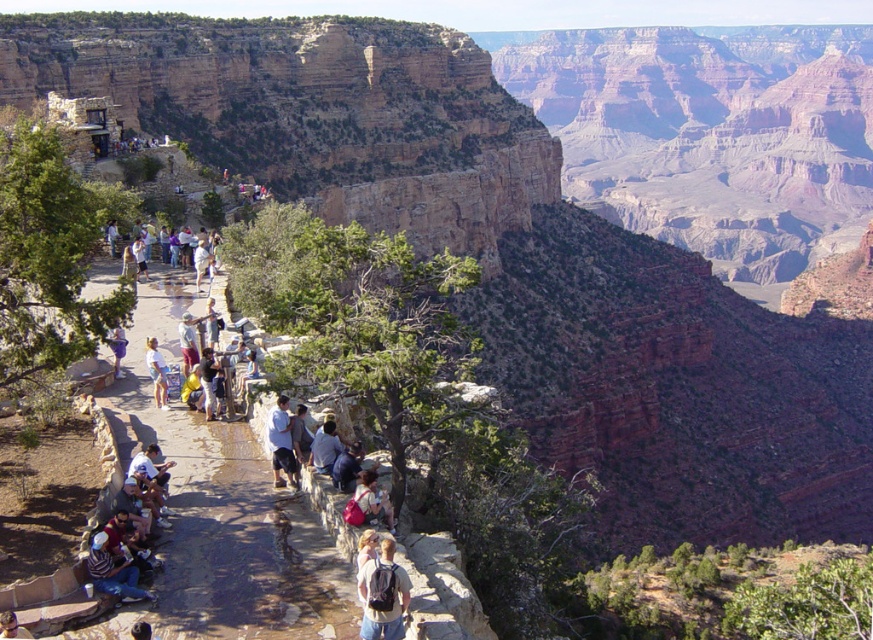
Question: Which of the following is the closest to the observer?

Choices:
 (A) light blue denim shorts at lower left
 (B) matte gray backpack at center
 (C) light blue shirt at center

Answer: (B)

Question: Is matte gray backpack at center closer to the viewer compared to light blue shirt at center?

Choices:
 (A) no
 (B) yes

Answer: (B)

Question: Which object is positioned farthest from the light brown leather jacket at lower left?

Choices:
 (A) light blue shirt at center
 (B) light blue denim shorts at lower left
 (C) matte gray backpack at center

Answer: (B)

Question: Is light blue denim shorts at center to the left of light blue denim shorts at lower left from the viewer's perspective?

Choices:
 (A) yes
 (B) no

Answer: (B)

Question: Can you confirm if light blue shirt at center is thinner than light brown leather jacket at lower left?

Choices:
 (A) yes
 (B) no

Answer: (B)

Question: Which of the following is the farthest from the observer?

Choices:
 (A) light blue shirt at center
 (B) light brown leather jacket at lower left
 (C) matte gray backpack at center
 (D) light blue denim shorts at lower left

Answer: (A)